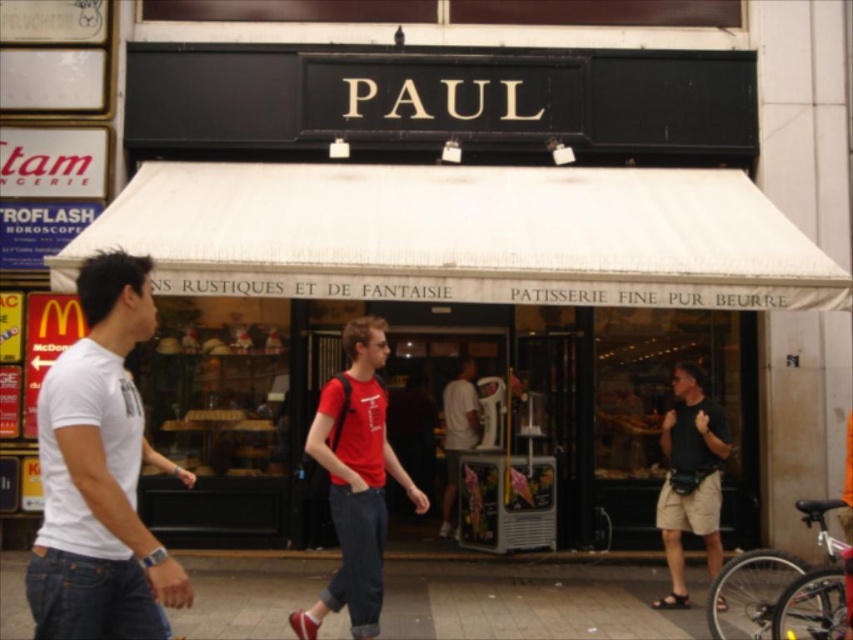
Question: Which object appears closest to the camera in this image?

Choices:
 (A) red cotton t-shirt at center
 (B) dark gray fabric bag at center right
 (C) smooth concrete pavement at lower center
 (D) white t-shirt at center

Answer: (A)

Question: Is dark gray fabric bag at center right behind white t-shirt at center?

Choices:
 (A) yes
 (B) no

Answer: (B)

Question: Which of these objects is positioned closest to the white cotton t-shirt at left?

Choices:
 (A) smooth concrete pavement at lower center
 (B) white t-shirt at center

Answer: (A)

Question: Considering the relative positions of red cotton t-shirt at center and white t-shirt at center in the image provided, where is red cotton t-shirt at center located with respect to white t-shirt at center?

Choices:
 (A) right
 (B) left

Answer: (B)

Question: Which of these objects is positioned farthest from the smooth concrete pavement at lower center?

Choices:
 (A) red cotton t-shirt at center
 (B) dark gray fabric bag at center right

Answer: (A)

Question: Can you confirm if white cotton t-shirt at left is bigger than red cotton t-shirt at center?

Choices:
 (A) yes
 (B) no

Answer: (B)